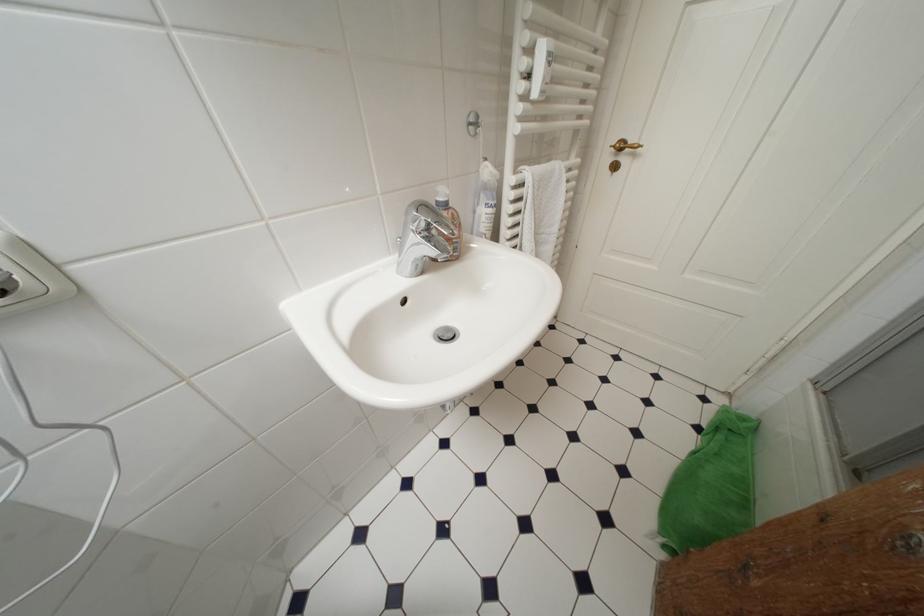
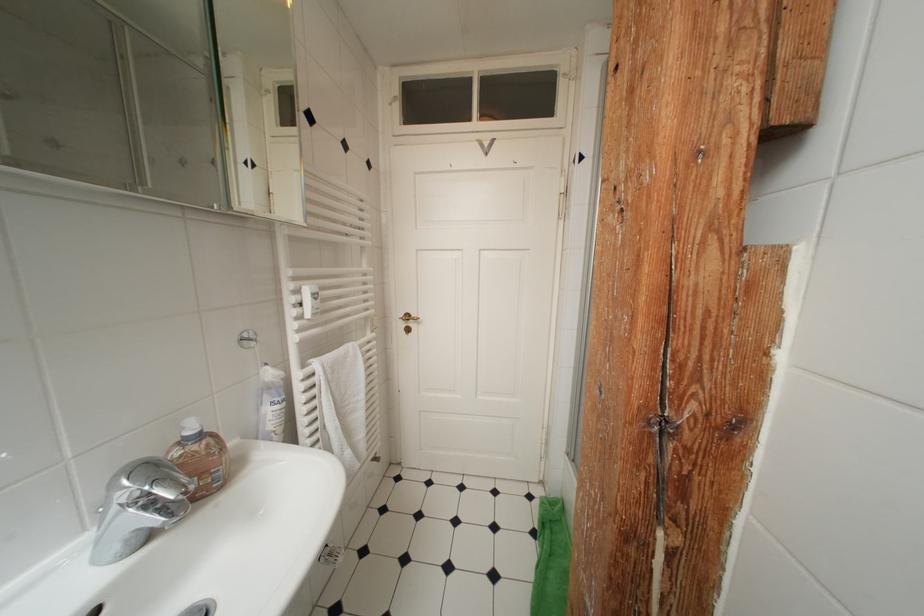
Find the pixel in the second image that matches [537,53] in the first image.

(304, 294)